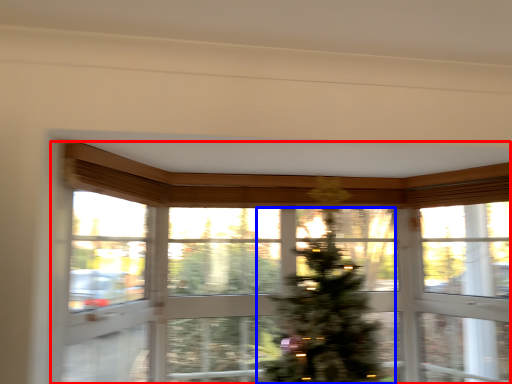
Question: Which object is further to the camera taking this photo, window (highlighted by a red box) or christmas tree (highlighted by a blue box)?

Choices:
 (A) window
 (B) christmas tree

Answer: (B)